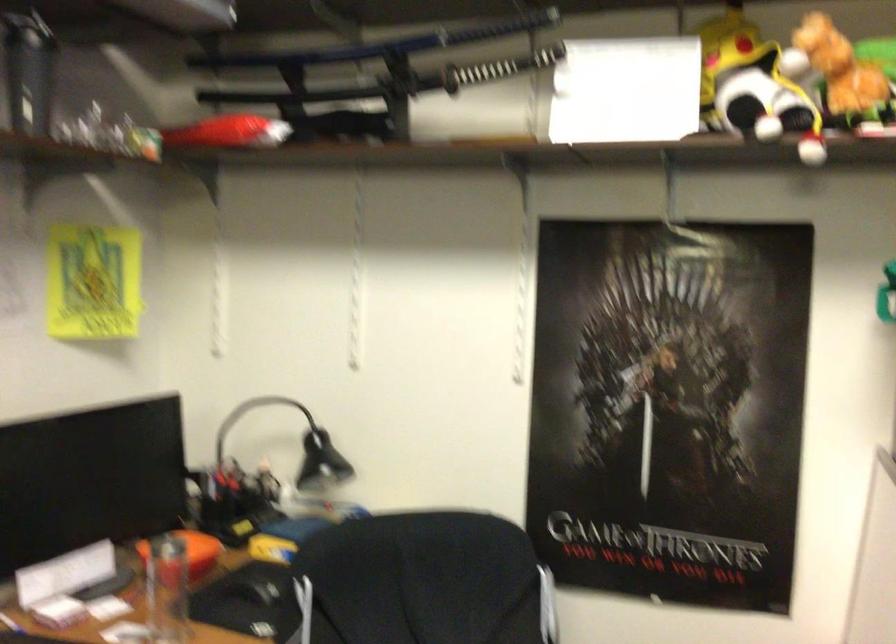
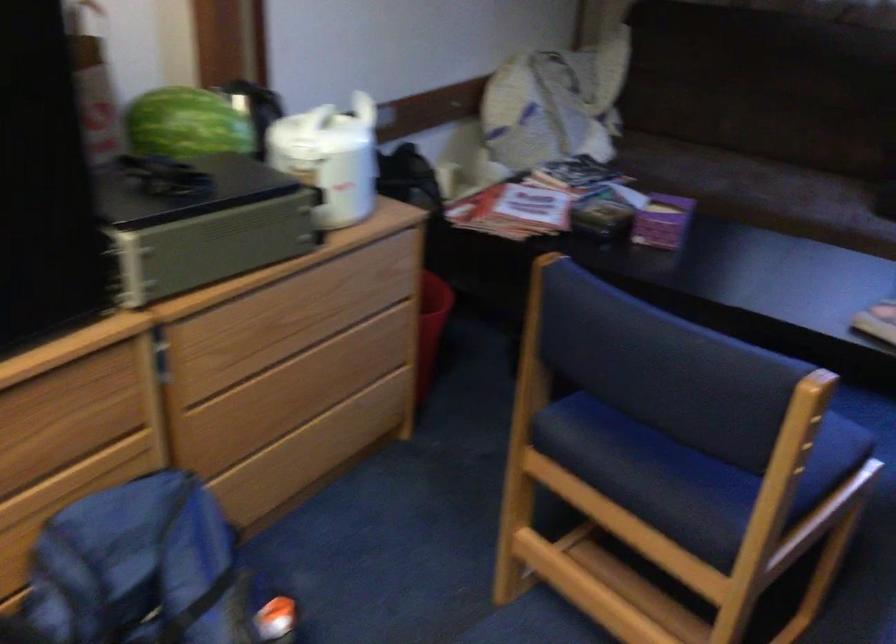
Based on the photo, based on the continuous images, in which direction is the camera rotating?

The rotation direction of the camera is right-down.